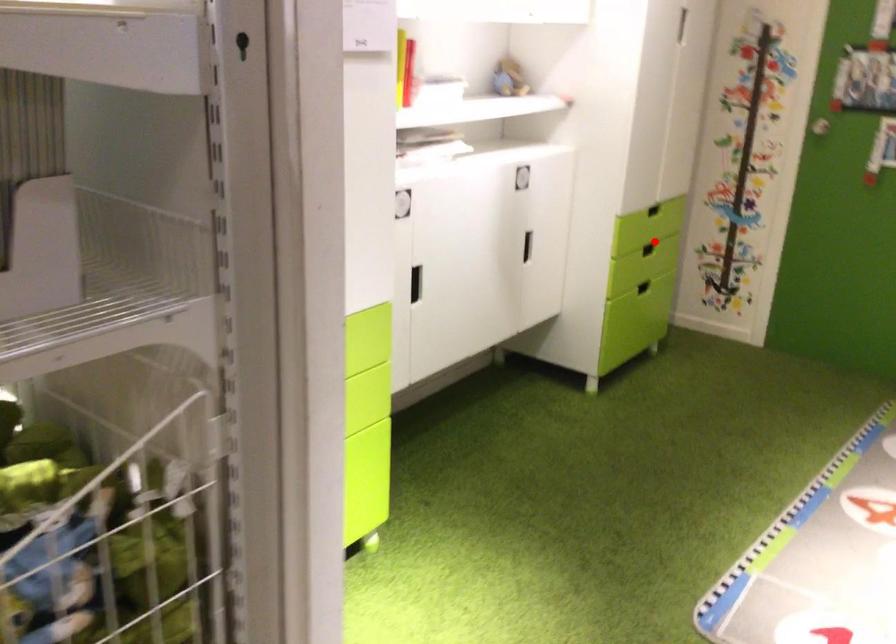
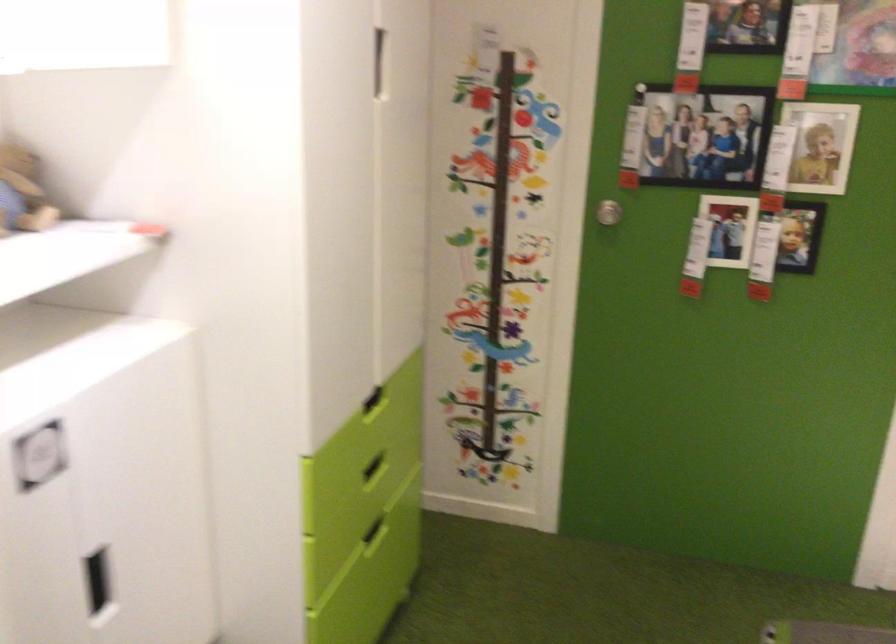
Question: I am providing you with two images of the same scene from different viewpoints. A red point is shown in image1. For the corresponding object point in image2, is it positioned nearer or farther from the camera?

Choices:
 (A) Nearer
 (B) Farther

Answer: (A)